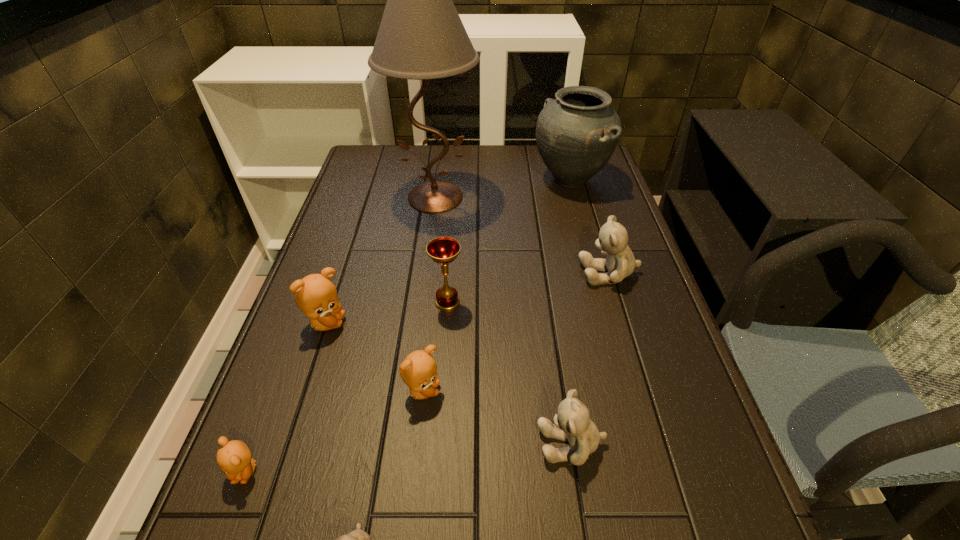
You are a GUI agent. You are given a task and a screenshot of the screen. Output one action in this format:
    pyautogui.click(x=<x>, y=<y>)
    Task: Click on the object present at the far left corner
    Image resolution: width=960 pixels, height=540 pixels.
    Given the screenshot: What is the action you would take?
    pyautogui.click(x=421, y=36)

At what (x,y) coordinates should I click in order to perform the action: click on object present at the far right corner. Please return your answer as a coordinate pair (x, y). Looking at the image, I should click on pos(576,134).

Find the location of a particular element. Image resolution: width=960 pixels, height=540 pixels. free location at the far edge is located at coordinates (479, 166).

The width and height of the screenshot is (960, 540). Identify the location of vacant region at the left edge of the desktop. (391, 193).

This screenshot has height=540, width=960. I want to click on blank space at the right edge of the desktop, so click(588, 215).

Where is `free space between the urn and the second biggest gray teddy bear`? The width and height of the screenshot is (960, 540). free space between the urn and the second biggest gray teddy bear is located at coordinates [570, 312].

Locate an element on the screen. empty space between the table lamp and the rightmost brown teddy bear is located at coordinates (429, 294).

I want to click on free space between the smallest brown teddy bear and the chalice, so click(347, 386).

Where is `empty space between the biggest gray teddy bear and the tallest object`? empty space between the biggest gray teddy bear and the tallest object is located at coordinates (522, 235).

Identify the location of free space between the second tallest object and the chalice. The height and width of the screenshot is (540, 960). (509, 241).